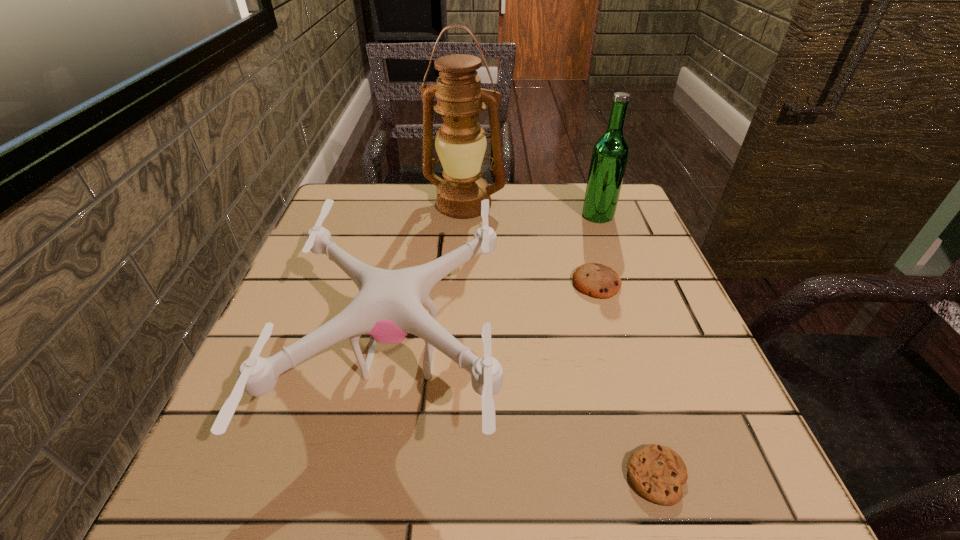
This screenshot has height=540, width=960. Find the location of `vacant region between the fourth tallest object and the oil lamp`. vacant region between the fourth tallest object and the oil lamp is located at coordinates (530, 244).

The image size is (960, 540). I want to click on vacant area that lies between the tallest object and the fourth tallest object, so click(530, 244).

Find the location of a particular element. The image size is (960, 540). vacant region between the second tallest object and the tallest object is located at coordinates (531, 210).

Where is `vacant space that's between the nearer cookie and the fourth tallest object`? vacant space that's between the nearer cookie and the fourth tallest object is located at coordinates [626, 380].

This screenshot has height=540, width=960. In order to click on vacant space that's between the second shortest object and the second tallest object in this screenshot , I will do `click(597, 249)`.

Image resolution: width=960 pixels, height=540 pixels. In order to click on empty location between the drone and the beer bottle in this screenshot , I will do `click(499, 286)`.

Where is `object that can be found as the closest to the second tallest object`? The height and width of the screenshot is (540, 960). object that can be found as the closest to the second tallest object is located at coordinates (596, 280).

Identify which object is the fourth nearest to the drone. Please provide its 2D coordinates. Your answer should be formatted as a tuple, i.e. [(x, y)], where the tuple contains the x and y coordinates of a point satisfying the conditions above.

[(610, 153)]

The width and height of the screenshot is (960, 540). What are the coordinates of `vacant space that satisfies the following two spatial constraints: 1. on the front side of the beer bottle; 2. on the left side of the oil lamp` in the screenshot? It's located at [x=464, y=215].

Identify the location of free space that satisfies the following two spatial constraints: 1. on the front side of the tallest object; 2. on the right side of the taller cookie. [460, 283].